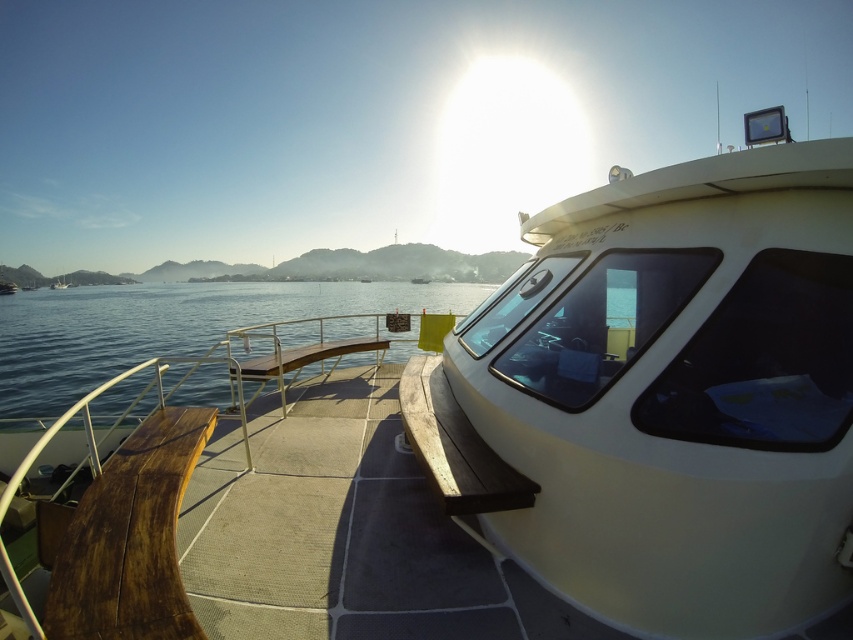
You are a sailor on the deck of the boat and need to move from the white matte boat at right to the clear blue water at center. Considering their sizes, which object do you think you can step onto first without needing to adjust your position?

The white matte boat at right is shorter than the clear blue water at center, so you can step onto the white matte boat at right first since it is closer in height.

You are a sailor trying to navigate through a narrow channel. You see the white matte boat at right and the clear blue water at center. Which object is narrower in width?

The white matte boat at right is thinner than clear blue water at center, so the white matte boat at right is narrower in width.